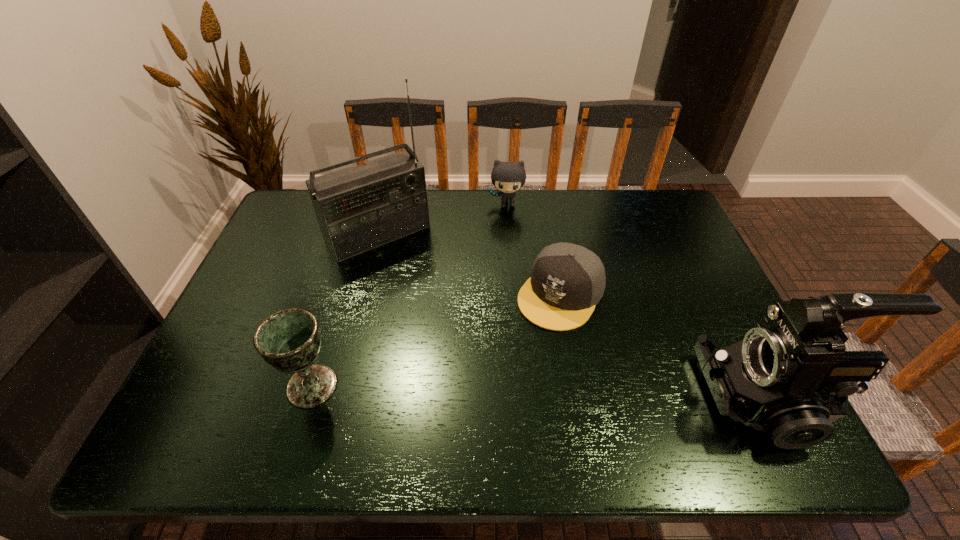
This screenshot has height=540, width=960. I want to click on kitten located at the far edge, so (x=508, y=177).

This screenshot has height=540, width=960. What are the coordinates of `chalice located at the near edge` in the screenshot? It's located at (289, 340).

The image size is (960, 540). I want to click on camcorder located at the near edge, so click(786, 376).

Find the location of a particular element. object situated at the right edge is located at coordinates (786, 376).

Identify the location of object present at the near right corner. The width and height of the screenshot is (960, 540). (786, 376).

The height and width of the screenshot is (540, 960). In order to click on free space at the far edge of the desktop in this screenshot , I will do `click(464, 190)`.

I want to click on free space at the left edge of the desktop, so click(301, 238).

In the image, there is a desktop. Where is `free space at the right edge`? The width and height of the screenshot is (960, 540). free space at the right edge is located at coordinates (704, 293).

At what (x,y) coordinates should I click in order to perform the action: click on vacant space at the near left corner of the desktop. Please return your answer as a coordinate pair (x, y). The image size is (960, 540). Looking at the image, I should click on 246,379.

You are a GUI agent. You are given a task and a screenshot of the screen. Output one action in this format:
    pyautogui.click(x=<x>, y=<y>)
    Task: Click on the vacant space at the far right corner
    The width and height of the screenshot is (960, 540).
    Given the screenshot: What is the action you would take?
    pyautogui.click(x=658, y=218)